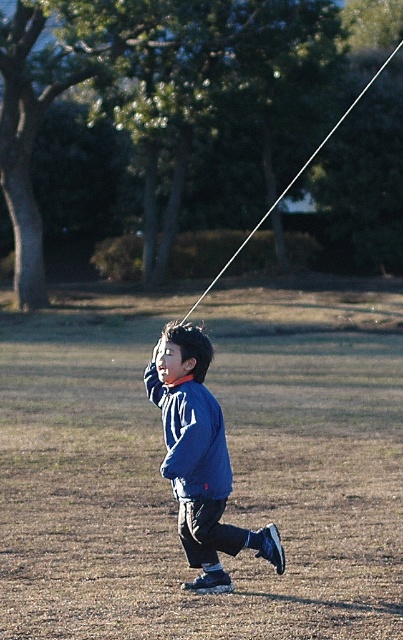
You are a photographer trying to capture a photo of the child and the kite string. Based on the scene, where should you position yourself to ensure both the matte blue jacket at center and the white string at upper center are clearly visible in the frame?

Position yourself so that the matte blue jacket at center is below the white string at upper center in the frame, ensuring both are within the camera view.

You are a photographer trying to capture the child in the blue matte jacket at center while also including the white string at upper center in the shot. Based on their sizes in the image, which object should you focus on first to ensure both are in frame?

The blue matte jacket at center occupies less space than the white string at upper center, so you should focus on the white string at upper center first to ensure both are in frame.